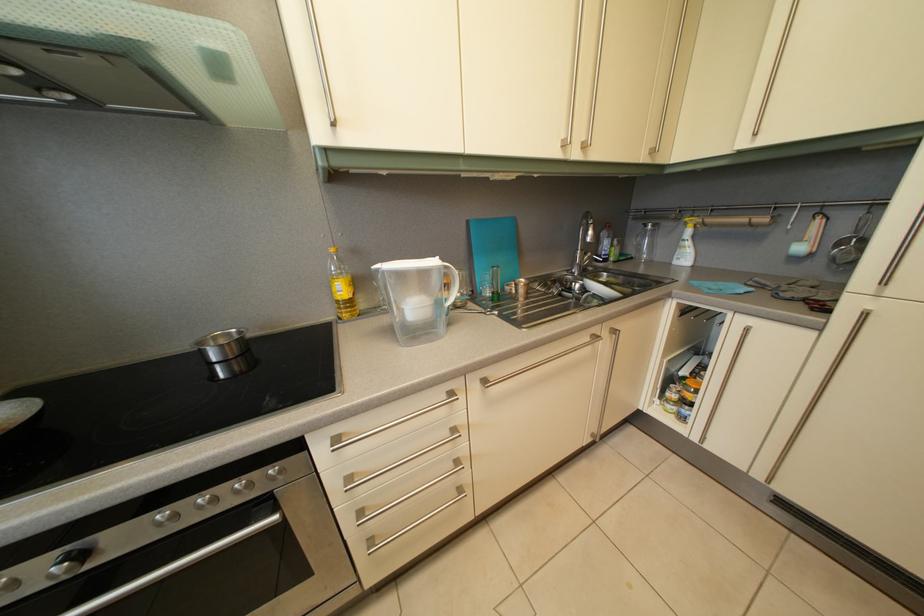
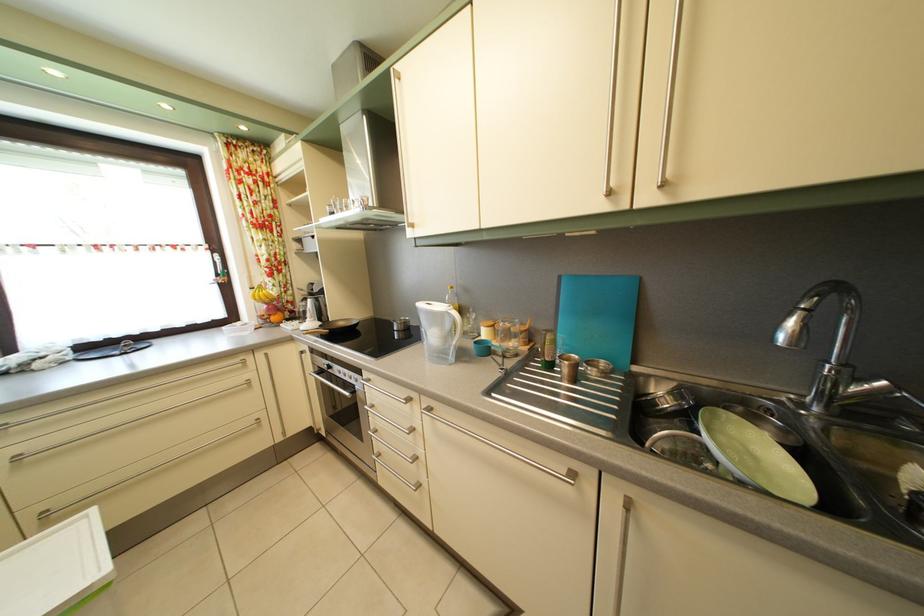
In the second image, find the point that corresponds to point (529, 299) in the first image.

(574, 378)